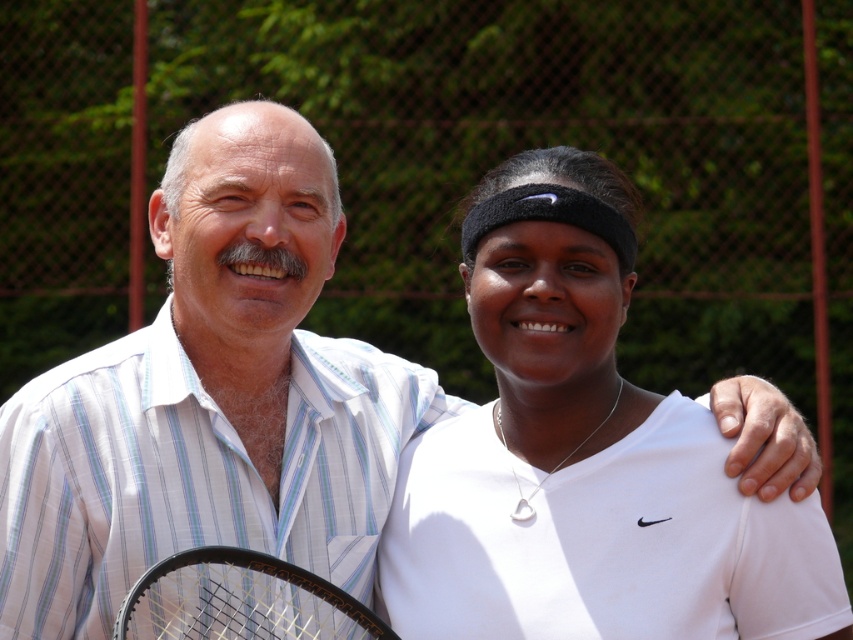
You are standing at the origin of a coordinate system and looking towards the tennis court. You see two points marked in the image. Which point is closer to you, point [592,428] or point [379,628]?

Point [379,628] is closer to you because it is in front of point [592,428].

Where is the white matte tennis racket at center located in the image?

The white matte tennis racket at center is located at point coordinates of (x=584, y=456).